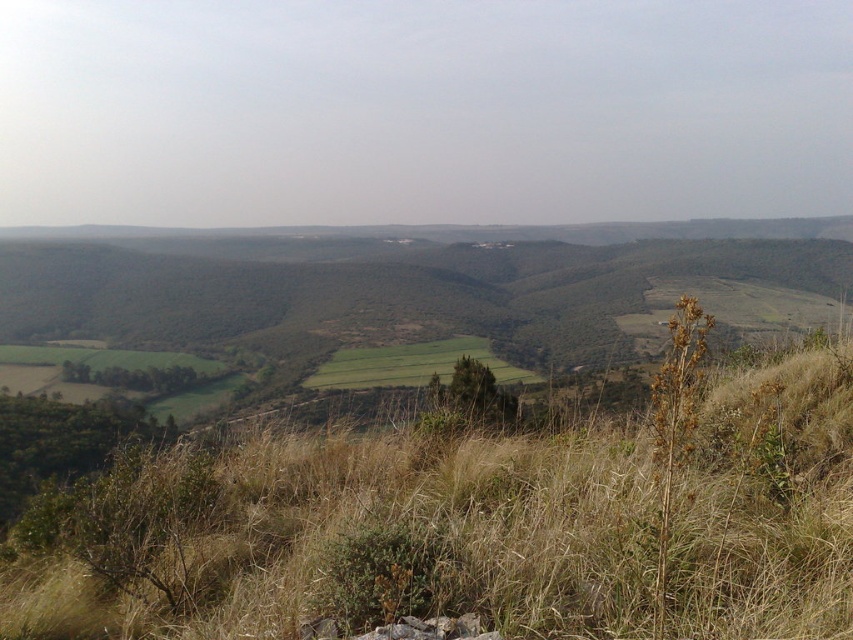
Question: Does brown dry grass at center appear under green grassy field at center?

Choices:
 (A) yes
 (B) no

Answer: (A)

Question: Can you confirm if brown dry grass at center is smaller than green grassy field at center?

Choices:
 (A) no
 (B) yes

Answer: (B)

Question: Which point is closer to the camera?

Choices:
 (A) (323, 520)
 (B) (531, 380)

Answer: (A)

Question: In this image, where is brown dry grass at center located relative to green grassy field at center?

Choices:
 (A) left
 (B) right

Answer: (B)

Question: Which of the following is the closest to the observer?

Choices:
 (A) green grassy field at center
 (B) brown dry grass at center

Answer: (B)